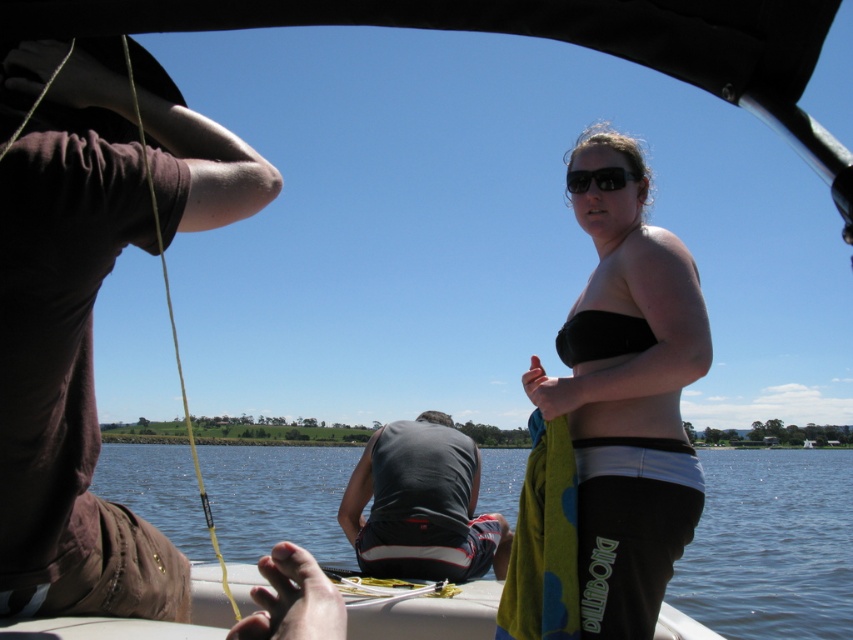
Question: Estimate the real-world distances between objects in this image. Which object is closer to the black matte bikini top at center?

Choices:
 (A) black matte sunglasses at upper center
 (B) clear water at center

Answer: (A)

Question: Which object is positioned closest to the black matte sunglasses at upper center?

Choices:
 (A) dark gray fabric shirt at center
 (B) black matte bikini top at center
 (C) brown cotton shirt at upper left

Answer: (B)

Question: Which point is closer to the camera taking this photo?

Choices:
 (A) (103, 243)
 (B) (495, 563)
 (C) (341, 556)

Answer: (A)

Question: Is clear water at center wider than black matte sunglasses at upper center?

Choices:
 (A) no
 (B) yes

Answer: (B)

Question: Is black matte bikini top at upper right thinner than black matte bikini top at center?

Choices:
 (A) yes
 (B) no

Answer: (B)

Question: Can you confirm if clear water at center is smaller than dark gray fabric shirt at center?

Choices:
 (A) no
 (B) yes

Answer: (A)